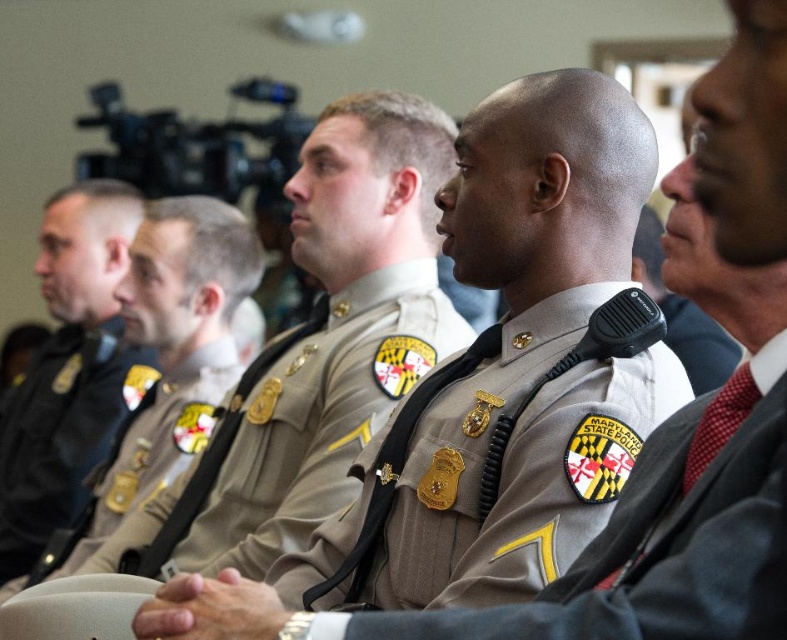
You are a photographer at the event and need to ensure that both the matte black uniform at left and the red silk tie at center are visible in your photo. Given their sizes, which object should you focus on to capture both without cropping?

The matte black uniform at left is wider than the red silk tie at center, so focusing on the matte black uniform at left will ensure both are visible without cropping.